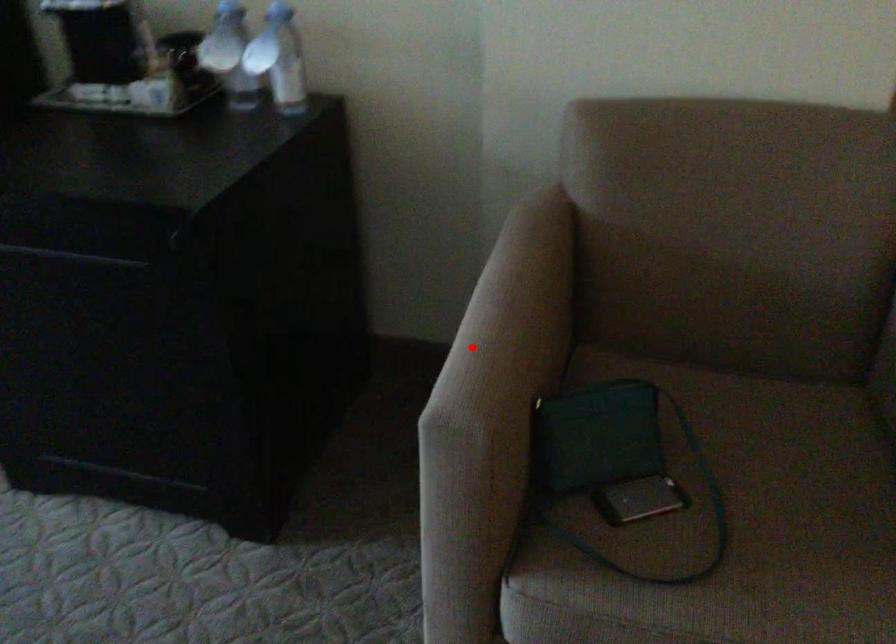
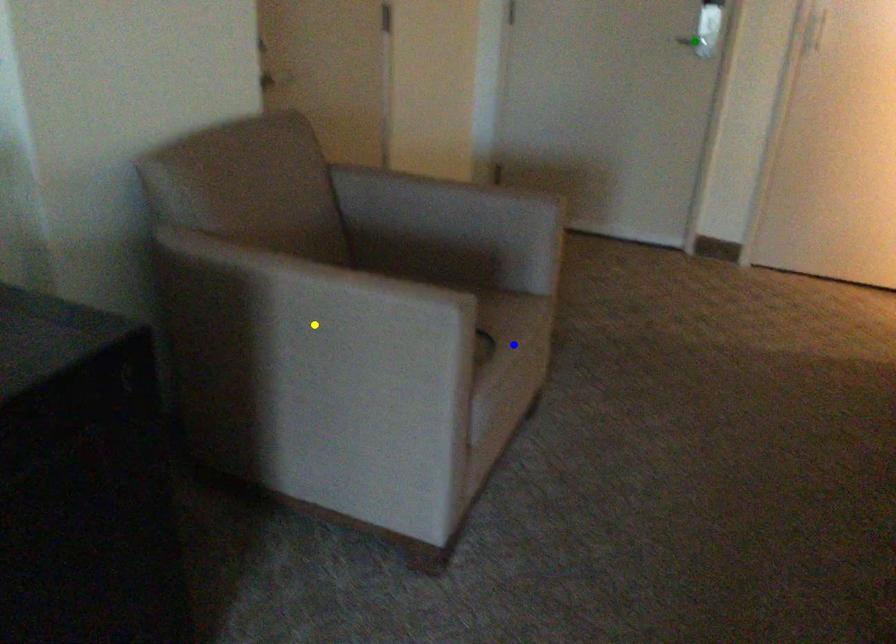
Question: I am providing you with two images of the same scene from different viewpoints. A red point is marked on the first image. You are given multiple points on the second image. Which point in image 2 is actually the same real-world point as the red point in image 1?

Choices:
 (A) blue point
 (B) green point
 (C) yellow point

Answer: (C)